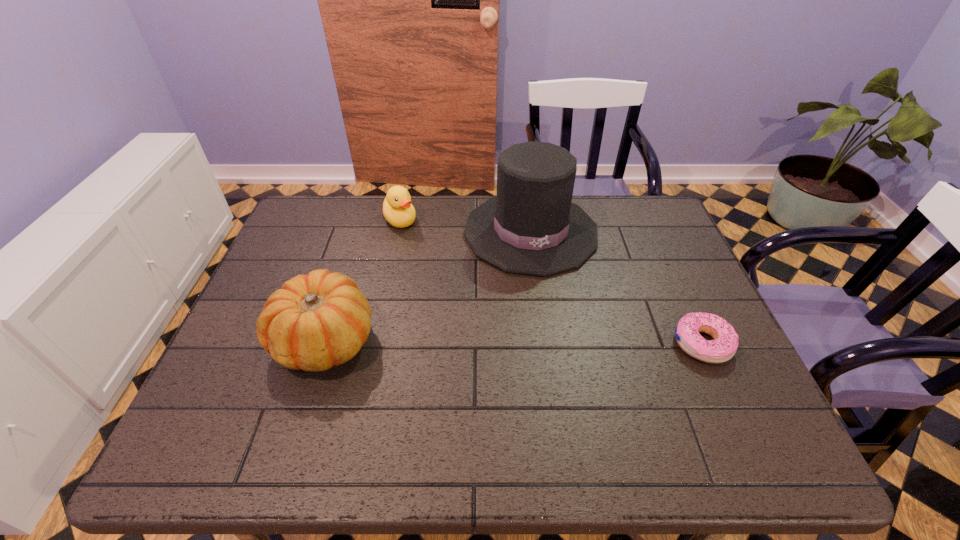
You are a GUI agent. You are given a task and a screenshot of the screen. Output one action in this format:
    pyautogui.click(x=<x>, y=<y>)
    Task: Click on the free space on the desktop that is between the gourd and the doughnut and is positioned on the front of the third object from left to right with the decoration
    Image resolution: width=960 pixels, height=540 pixels.
    Given the screenshot: What is the action you would take?
    pyautogui.click(x=563, y=342)

Where is `free space on the desktop that is between the second tallest object and the rightmost object and is positioned on the face of the second shortest object`? free space on the desktop that is between the second tallest object and the rightmost object and is positioned on the face of the second shortest object is located at coordinates 475,341.